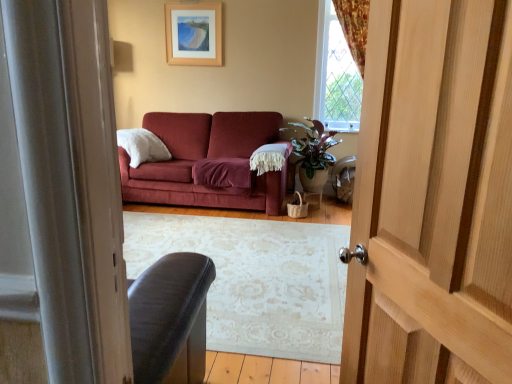
Question: From the image's perspective, is green glossy plant at center on top of light brown wooden door at right?

Choices:
 (A) no
 (B) yes

Answer: (B)

Question: Can you confirm if green glossy plant at center is positioned to the right of light brown wooden door at right?

Choices:
 (A) no
 (B) yes

Answer: (B)

Question: Are green glossy plant at center and light brown wooden door at right beside each other?

Choices:
 (A) yes
 (B) no

Answer: (B)

Question: From the image's perspective, is green glossy plant at center beneath light brown wooden door at right?

Choices:
 (A) yes
 (B) no

Answer: (B)

Question: Is green glossy plant at center positioned in front of light brown wooden door at right?

Choices:
 (A) yes
 (B) no

Answer: (B)

Question: Does green glossy plant at center turn towards light brown wooden door at right?

Choices:
 (A) no
 (B) yes

Answer: (B)

Question: Is clear glass window at upper right next to wooden picture frame at upper center?

Choices:
 (A) no
 (B) yes

Answer: (A)

Question: Considering the relative positions of clear glass window at upper right and wooden picture frame at upper center in the image provided, is clear glass window at upper right behind wooden picture frame at upper center?

Choices:
 (A) yes
 (B) no

Answer: (B)

Question: From the image's perspective, is clear glass window at upper right located beneath wooden picture frame at upper center?

Choices:
 (A) no
 (B) yes

Answer: (B)

Question: Is clear glass window at upper right facing away from wooden picture frame at upper center?

Choices:
 (A) no
 (B) yes

Answer: (A)

Question: Are clear glass window at upper right and wooden picture frame at upper center located far from each other?

Choices:
 (A) yes
 (B) no

Answer: (A)

Question: Is clear glass window at upper right thinner than wooden picture frame at upper center?

Choices:
 (A) no
 (B) yes

Answer: (A)

Question: Is the depth of wooden picture frame at upper center greater than that of clear glass window at upper right?

Choices:
 (A) yes
 (B) no

Answer: (A)